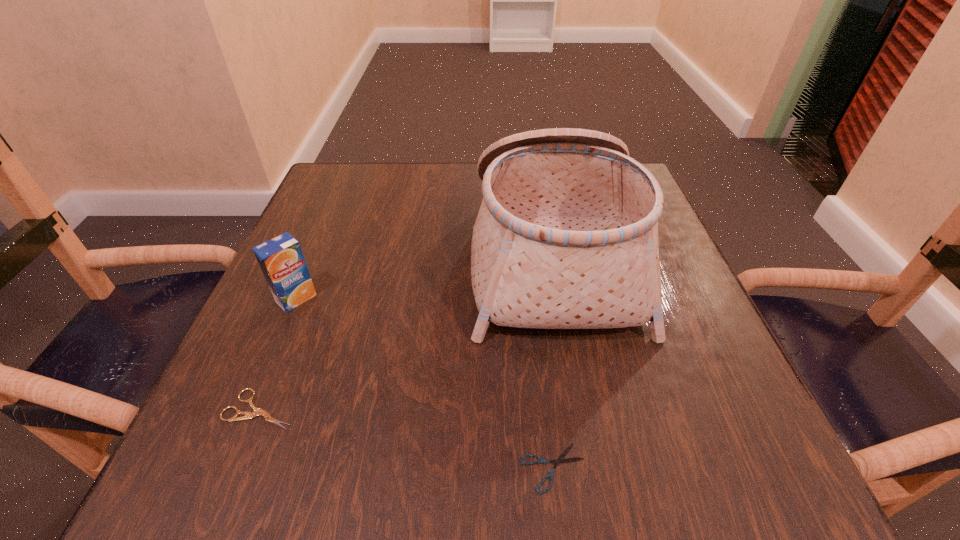
Find the location of `free space located 0.340m on the back of the third tallest object`. free space located 0.340m on the back of the third tallest object is located at coordinates pyautogui.click(x=326, y=246).

Image resolution: width=960 pixels, height=540 pixels. What are the coordinates of `free point located on the right of the nearer shears` in the screenshot? It's located at (740, 468).

I want to click on object that is at the far edge, so click(x=566, y=237).

The image size is (960, 540). I want to click on orange_juice positioned at the left edge, so click(281, 260).

Where is `shears that is at the left edge`? Image resolution: width=960 pixels, height=540 pixels. shears that is at the left edge is located at coordinates tap(257, 411).

Where is `object positioned at the right edge`? object positioned at the right edge is located at coordinates (566, 237).

At what (x,y) coordinates should I click in order to perform the action: click on object positioned at the near left corner. Please return your answer as a coordinate pair (x, y). Looking at the image, I should click on (257, 411).

Image resolution: width=960 pixels, height=540 pixels. I want to click on object that is at the far right corner, so click(x=566, y=237).

Where is `vacant point at the near edge`? vacant point at the near edge is located at coordinates (456, 486).

Find the location of `free space at the left edge of the desktop`. free space at the left edge of the desktop is located at coordinates (314, 343).